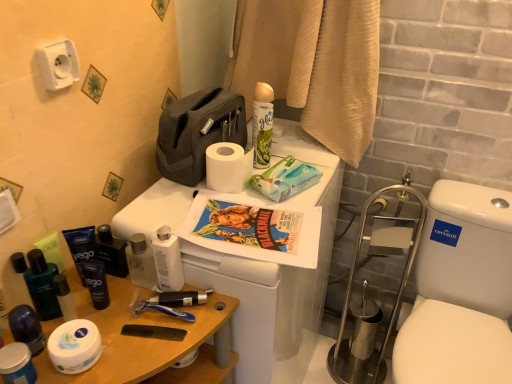
Identify the location of free space that is in between white matte lotion at center, the 1th toiletry when ordered from right to left, and white matte toilet paper at lower left, which ranks as the 2th toilet paper in right-to-left order. This screenshot has width=512, height=384. pos(126,324).